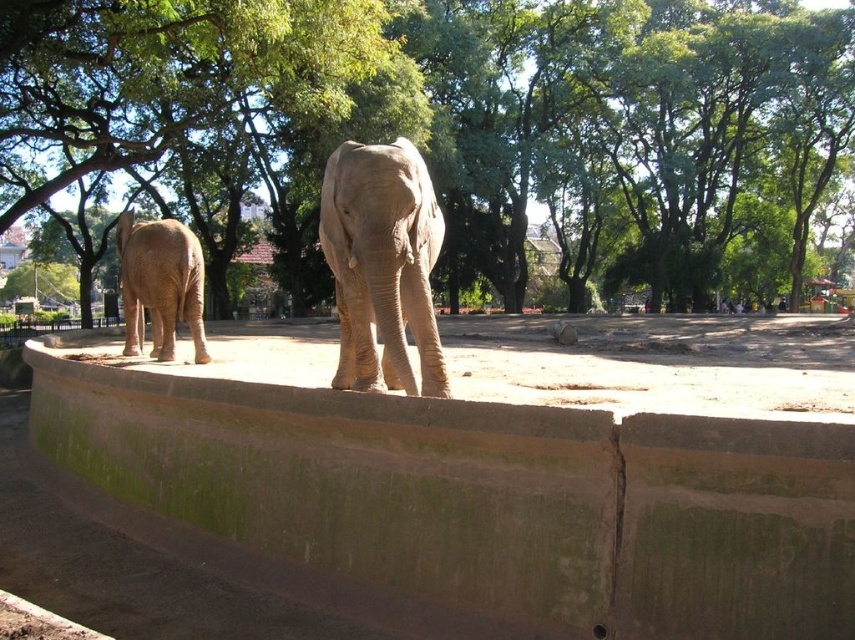
Does green leafy tree at center have a lesser height compared to green leafy tree at upper left?

No.

Which is behind, point (553, 38) or point (124, 44)?

Point (553, 38)

At what (x,y) coordinates should I click in order to perform the action: click on green leafy tree at center. Please return your answer as a coordinate pair (x, y). The width and height of the screenshot is (855, 640). Looking at the image, I should click on (455, 125).

Which is more to the right, matte brown elephant at left or smooth brown elephant at center?

smooth brown elephant at center

From the picture: Is matte brown elephant at left shorter than smooth brown elephant at center?

No.

Which is in front, point (198, 348) or point (720, 300)?

Point (198, 348) is more forward.

You are a GUI agent. You are given a task and a screenshot of the screen. Output one action in this format:
    pyautogui.click(x=<x>, y=<y>)
    Task: Click on the matte brown elephant at left
    The height and width of the screenshot is (640, 855).
    Given the screenshot: What is the action you would take?
    pyautogui.click(x=160, y=284)

Which is in front, point (357, 364) or point (732, 298)?

Point (357, 364)

The height and width of the screenshot is (640, 855). What are the coordinates of `gray textured elephant at center` in the screenshot? It's located at pyautogui.click(x=382, y=264).